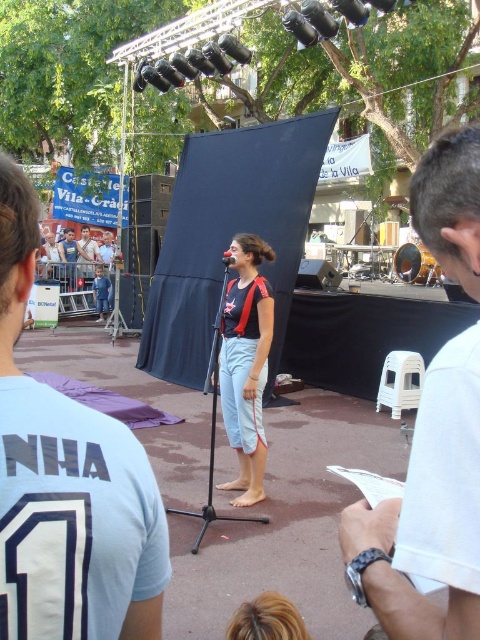
Is white cotton shirt at center shorter than black matte microphone at center?

No, white cotton shirt at center is not shorter than black matte microphone at center.

Which is behind, point (0, 288) or point (228, 252)?

The point (228, 252) is more distant.

Does point (111, 433) come closer to viewer compared to point (224, 260)?

Yes, it is.

Find the location of a particular element. The height and width of the screenshot is (640, 480). white cotton shirt at center is located at coordinates (67, 484).

I want to click on matte black tank top at center, so click(x=245, y=364).

Does matte black tank top at center appear on the right side of black matte microphone at center?

Yes, matte black tank top at center is to the right of black matte microphone at center.

Which is behind, point (259, 444) or point (231, 260)?

The point (259, 444) is more distant.

The image size is (480, 640). Find the location of `matte black tank top at center`. matte black tank top at center is located at coordinates (245, 364).

Does white cotton shirt at center come in front of white fabric shirt at upper right?

That is True.

Does white cotton shirt at center have a larger size compared to white fabric shirt at upper right?

No.

Identify the location of white cotton shirt at center. (67, 484).